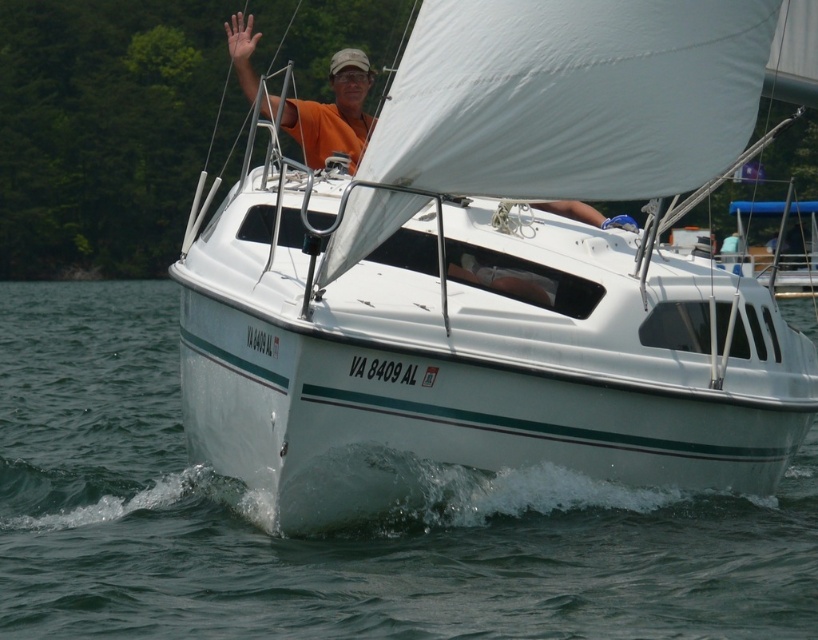
Question: Does white glossy sailboat at center appear under clear water at lower center?

Choices:
 (A) yes
 (B) no

Answer: (B)

Question: Which point is closer to the camera taking this photo?

Choices:
 (A) (241, 13)
 (B) (670, 284)

Answer: (B)

Question: Which of the following is the closest to the observer?

Choices:
 (A) clear water at lower center
 (B) orange fabric shirt at upper center

Answer: (A)

Question: Does clear water at lower center appear under orange fabric shirt at upper center?

Choices:
 (A) yes
 (B) no

Answer: (A)

Question: Which is farther from the white glossy sailboat at center?

Choices:
 (A) clear water at lower center
 (B) orange fabric shirt at upper center

Answer: (A)

Question: Can you confirm if white glossy sailboat at center is positioned to the right of orange fabric shirt at upper center?

Choices:
 (A) yes
 (B) no

Answer: (A)